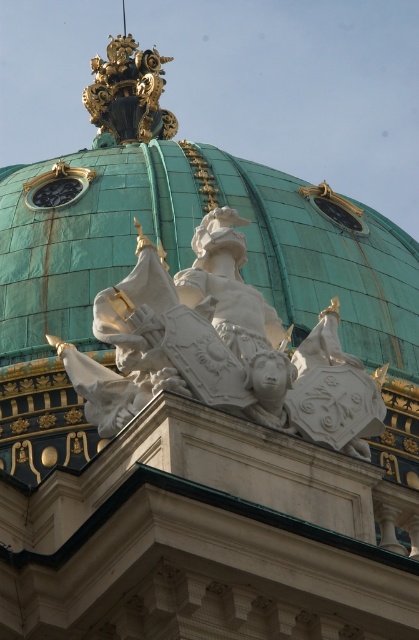
What are the coordinates of the green copper dome at center?

The green copper dome at center is located at coordinates point (87, 240).

You are an architect designing a new building and want to place a statue exactly at the center of the green copper dome at center. According to the coordinates provided, where should you place the statue?

The green copper dome at center is located at coordinates point [87,240], so the statue should be placed at that point to be at its center.

What object is located at the coordinates point (87, 240)?

The green copper dome at center is located at point (87, 240).